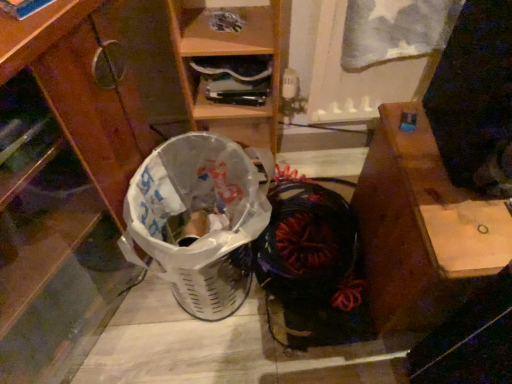
Question: From the image's perspective, would you say brushed wood cabinet at lower left is shown under black fabric shoe at center?

Choices:
 (A) yes
 (B) no

Answer: (B)

Question: Is brushed wood cabinet at lower left smaller than black fabric shoe at center?

Choices:
 (A) yes
 (B) no

Answer: (B)

Question: Can you confirm if brushed wood cabinet at lower left is thinner than black fabric shoe at center?

Choices:
 (A) yes
 (B) no

Answer: (B)

Question: Is brushed wood cabinet at lower left at the right side of black fabric shoe at center?

Choices:
 (A) no
 (B) yes

Answer: (A)

Question: Is brushed wood cabinet at lower left looking in the opposite direction of black fabric shoe at center?

Choices:
 (A) yes
 (B) no

Answer: (B)

Question: Does point (309, 345) appear closer or farther from the camera than point (123, 24)?

Choices:
 (A) farther
 (B) closer

Answer: (B)

Question: Is black fabric shoe at center in front of or behind brushed wood cabinet at lower left in the image?

Choices:
 (A) behind
 (B) front

Answer: (A)

Question: From the image's perspective, is black fabric shoe at center positioned above or below brushed wood cabinet at lower left?

Choices:
 (A) below
 (B) above

Answer: (A)

Question: Is black fabric shoe at center taller or shorter than brushed wood cabinet at lower left?

Choices:
 (A) short
 (B) tall

Answer: (A)

Question: Is point (245, 196) positioned closer to the camera than point (346, 309)?

Choices:
 (A) closer
 (B) farther

Answer: (A)

Question: Considering the positions of white plastic shopping basket at lower left and black fabric shoe at center in the image, is white plastic shopping basket at lower left bigger or smaller than black fabric shoe at center?

Choices:
 (A) small
 (B) big

Answer: (B)

Question: Do you think white plastic shopping basket at lower left is within black fabric shoe at center, or outside of it?

Choices:
 (A) outside
 (B) inside

Answer: (A)

Question: In terms of height, does white plastic shopping basket at lower left look taller or shorter compared to black fabric shoe at center?

Choices:
 (A) short
 (B) tall

Answer: (B)

Question: Looking at the image, does wooden desk at right seem bigger or smaller compared to white plastic shopping basket at lower left?

Choices:
 (A) small
 (B) big

Answer: (B)

Question: From a real-world perspective, is wooden desk at right positioned above or below white plastic shopping basket at lower left?

Choices:
 (A) above
 (B) below

Answer: (A)